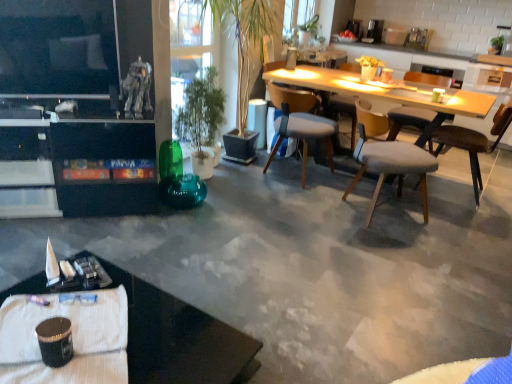
What do you see at coordinates (386, 75) in the screenshot?
I see `matte white mug at upper center, which is counted as the first coffee cup, starting from the top` at bounding box center [386, 75].

This screenshot has height=384, width=512. What do you see at coordinates (386, 93) in the screenshot? I see `light wood table at center` at bounding box center [386, 93].

This screenshot has height=384, width=512. Identify the location of light wood table at center. (386, 93).

Locate an element on the screen. The image size is (512, 384). white textured tablecloth at lower left is located at coordinates (72, 337).

Describe the element at coordinates (201, 120) in the screenshot. I see `green glossy plant at center` at that location.

Identify the location of matte white mug at upper center, which is counted as the first coffee cup, starting from the top. This screenshot has width=512, height=384. (386, 75).

From a real-world perspective, which is physically above, green glossy plant at center or metallic pen at lower left?

green glossy plant at center, from a real-world perspective.

Is green glossy plant at center with metallic pen at lower left?

No, green glossy plant at center is not next to metallic pen at lower left.

In the image, is green glossy plant at center positioned in front of or behind metallic pen at lower left?

Clearly, green glossy plant at center is behind metallic pen at lower left.

How much distance is there between green matte coffee cup at upper right, which is the 2th coffee cup in top-to-bottom order, and satin silver coffee maker at upper center?

green matte coffee cup at upper right, which is the 2th coffee cup in top-to-bottom order, is 6.92 feet away from satin silver coffee maker at upper center.

Could you tell me if green matte coffee cup at upper right, which is the 2th coffee cup in top-to-bottom order, is facing satin silver coffee maker at upper center?

No, green matte coffee cup at upper right, which is the 2th coffee cup in top-to-bottom order, is not aimed at satin silver coffee maker at upper center.

Considering the relative sizes of green matte coffee cup at upper right, the 2th coffee cup ordered from the bottom, and satin silver coffee maker at upper center in the image provided, is green matte coffee cup at upper right, the 2th coffee cup ordered from the bottom, taller than satin silver coffee maker at upper center?

Incorrect, the height of green matte coffee cup at upper right, the 2th coffee cup ordered from the bottom, is not larger of that of satin silver coffee maker at upper center.

Considering the relative sizes of white textured tablecloth at lower left and white glossy lampshade at center in the image provided, is white textured tablecloth at lower left wider than white glossy lampshade at center?

Indeed, white textured tablecloth at lower left has a greater width compared to white glossy lampshade at center.

Can you tell me how much white textured tablecloth at lower left and white glossy lampshade at center differ in facing direction?

43.8 degrees separate the facing orientations of white textured tablecloth at lower left and white glossy lampshade at center.

Considering the sizes of objects white textured tablecloth at lower left and white glossy lampshade at center in the image provided, who is taller, white textured tablecloth at lower left or white glossy lampshade at center?

With more height is white glossy lampshade at center.

Does green glossy plant at center have a lesser width compared to light gray fabric chair at center, the 2th chair positioned from the left?

No.

Would you say green glossy plant at center is inside or outside light gray fabric chair at center, the 2th chair positioned from the left?

green glossy plant at center is spatially situated outside light gray fabric chair at center, the 2th chair positioned from the left.

Consider the image. From the image's perspective, between green glossy plant at center and light gray fabric chair at center, the 2th chair positioned from the left, which one is located above?

green glossy plant at center, from the image's perspective.

From a real-world perspective, is green glossy plant at center physically located above or below light gray fabric chair at center, acting as the 3th chair starting from the right?

green glossy plant at center is situated higher than light gray fabric chair at center, acting as the 3th chair starting from the right, in the real world.

Is point (425, 76) positioned behind point (433, 161)?

Yes, it is.

How much distance is there between light gray fabric chair at center right, which is counted as the second chair, starting from the right, and light gray fabric chair at center, acting as the 3th chair starting from the right?

light gray fabric chair at center right, which is counted as the second chair, starting from the right, and light gray fabric chair at center, acting as the 3th chair starting from the right, are 18.14 inches apart.

Which is behind, light gray fabric chair at center right, marked as the third chair in a left-to-right arrangement, or light gray fabric chair at center, acting as the 3th chair starting from the right?

light gray fabric chair at center right, marked as the third chair in a left-to-right arrangement, is further away from the camera.

From the picture: Does light gray fabric chair at center right, which is counted as the second chair, starting from the right, appear on the left side of light gray fabric chair at center, the 2th chair positioned from the left?

In fact, light gray fabric chair at center right, which is counted as the second chair, starting from the right, is to the right of light gray fabric chair at center, the 2th chair positioned from the left.

Considering the positions of objects green glossy plant at center and white glossy lampshade at center in the image provided, who is behind, green glossy plant at center or white glossy lampshade at center?

white glossy lampshade at center is behind.

Is green glossy plant at center positioned with its back to white glossy lampshade at center?

green glossy plant at center does not have its back to white glossy lampshade at center.

What's the angular difference between green glossy plant at center and white glossy lampshade at center's facing directions?

green glossy plant at center and white glossy lampshade at center are facing 9.88 degrees away from each other.

In the scene shown: From a real-world perspective, which object stands above the other?

In real-world perspective, green glossy plant at center is above.

Which of these two, brown leather chair at right, placed as the first chair when sorted from right to left, or light gray fabric chair at center, acting as the 3th chair starting from the right, is thinner?

brown leather chair at right, placed as the first chair when sorted from right to left, is thinner.

How many degrees apart are the facing directions of brown leather chair at right, which is the 4th chair from left to right, and light gray fabric chair at center, the 2th chair positioned from the left?

There is a 138-degree angle between the facing directions of brown leather chair at right, which is the 4th chair from left to right, and light gray fabric chair at center, the 2th chair positioned from the left.

Between point (471, 162) and point (362, 158), which one is positioned in front?

The point (362, 158) is more forward.

Where is `pen in front of the green glossy plant at center`? This screenshot has height=384, width=512. pen in front of the green glossy plant at center is located at coordinates (38, 300).

From the image's perspective, count 2nd coffee cups downward from the satin silver coffee maker at upper center and point to it. Please provide its 2D coordinates.

[(437, 95)]

Looking at the image, which one is located further to metallic pen at lower left, light gray fabric chair at center, acting as the 3th chair starting from the right, or shiny black cup at lower left, which is the 3th coffee cup in right-to-left order?

light gray fabric chair at center, acting as the 3th chair starting from the right, lies further to metallic pen at lower left than the other object.

Which object lies further to the anchor point shiny black cup at lower left, which is the 3th coffee cup in right-to-left order, light gray fabric chair at center, acting as the 3th chair starting from the right, or brown leather chair at right, which is the 4th chair from left to right?

Among the two, brown leather chair at right, which is the 4th chair from left to right, is located further to shiny black cup at lower left, which is the 3th coffee cup in right-to-left order.

Estimate the real-world distances between objects in this image. Which object is closer to satin silver coffee maker at upper center, brown leather chair at right, which is the 4th chair from left to right, or light gray fabric chair at center right, which is counted as the second chair, starting from the right?

The object closer to satin silver coffee maker at upper center is light gray fabric chair at center right, which is counted as the second chair, starting from the right.

Considering their positions, is green glossy plant at center positioned closer to metallic pen at lower left than light gray fabric chair at center, the 2th chair positioned from the left?

green glossy plant at center is closer to metallic pen at lower left.

When comparing their distances from light gray fabric chair at center, acting as the 3th chair starting from the right, does green glossy plant at center or black glossy desk at lower left seem further?

black glossy desk at lower left.

Consider the image. Estimate the real-world distances between objects in this image. Which object is closer to green matte coffee cup at upper right, which ranks as the 2th coffee cup in front-to-back order, matte white mug at upper center, marked as the second coffee cup in a left-to-right arrangement, or light gray fabric chair at center, the 2th chair positioned from the left?

Based on the image, matte white mug at upper center, marked as the second coffee cup in a left-to-right arrangement, appears to be nearer to green matte coffee cup at upper right, which ranks as the 2th coffee cup in front-to-back order.

Which object lies further to the anchor point matte black entertainment center at left, matte white mug at upper center, which is the 2th coffee cup from right to left, or satin silver coffee maker at upper center?

satin silver coffee maker at upper center is positioned further to the anchor matte black entertainment center at left.

When comparing their distances from green matte coffee cup at upper right, the 2th coffee cup ordered from the bottom, does white glossy lampshade at center or gray fabric chair at center, the 4th chair from the right, seem closer?

gray fabric chair at center, the 4th chair from the right.

Find the location of a particular element. coffee cup positioned between green matte coffee cup at upper right, which is the 2th coffee cup in top-to-bottom order, and light wood table at center from near to far is located at coordinates (386, 75).

Find the location of a particular element. The width and height of the screenshot is (512, 384). plant between black glossy desk at lower left and gray fabric chair at center, the 4th chair from the right, in the front-back direction is located at coordinates (244, 41).

Image resolution: width=512 pixels, height=384 pixels. I want to click on entertainment center between white textured tablecloth at lower left and green glossy plant at center in the front-back direction, so click(x=82, y=106).

What are the coordinates of `plant between light gray fabric chair at center, acting as the 3th chair starting from the right, and satin silver coffee maker at upper center, along the z-axis` in the screenshot? It's located at (244, 41).